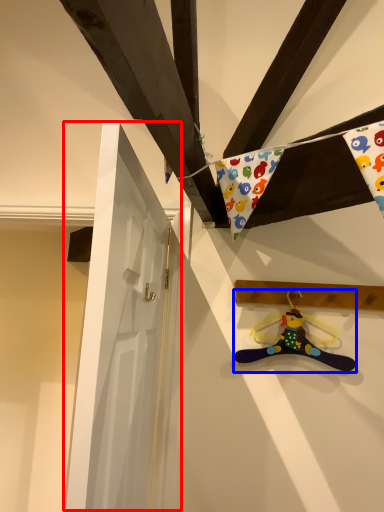
Question: Which of the following is the farthest to the observer, door (highlighted by a red box) or toy (highlighted by a blue box)?

Choices:
 (A) door
 (B) toy

Answer: (B)